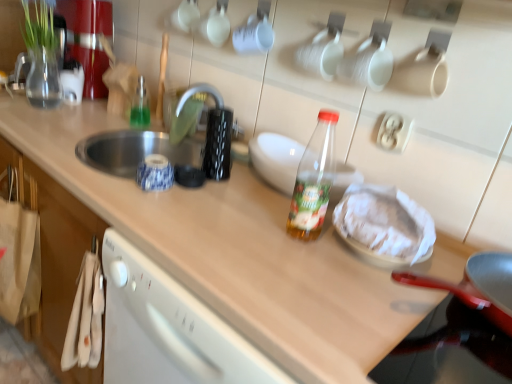
Question: Considering their positions, is transparent plastic bottle at center, arranged as the 1th bottle when viewed from the front, located in front of or behind transparent glass bottle at upper center, the 2th bottle in the bottom-to-top sequence?

Choices:
 (A) behind
 (B) front

Answer: (B)

Question: Visually, is transparent plastic bottle at center, the 2th bottle from the top, positioned to the left or to the right of transparent glass bottle at upper center, the 2th bottle in the bottom-to-top sequence?

Choices:
 (A) left
 (B) right

Answer: (B)

Question: Which is farther from the transparent glass bottle at upper center, the 2th bottle positioned from the front?

Choices:
 (A) transparent plastic bottle at center, which ranks as the 1th bottle in right-to-left order
 (B) white fabric cabinet at lower left
 (C) silver metallic faucet at upper center
 (D) transparent plastic bottle at center
 (E) white paper wrapped food at center

Answer: (E)

Question: Which object is positioned closest to the transparent glass bottle at upper center, which is the first bottle in top-to-bottom order?

Choices:
 (A) white fabric cabinet at lower left
 (B) white paper wrapped food at center
 (C) transparent plastic bottle at center
 (D) transparent plastic bottle at center, the 2th bottle from the top
 (E) silver metallic faucet at upper center

Answer: (E)